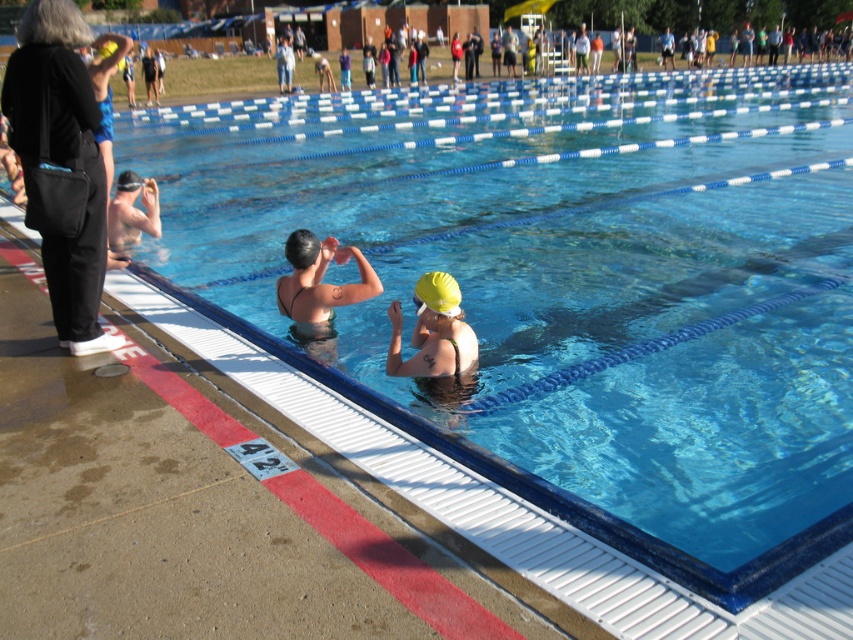
Consider the image. You are a lifeguard standing at the edge of the pool. You need to retrieve the black fabric bag at left and the yellow matte swim cap at center. Which object is closer to the water surface?

The black fabric bag at left is above the yellow matte swim cap at center, so the yellow matte swim cap at center is closer to the water surface.

You are a swimmer standing at the edge of the pool near the starting block. You need to grab your black fabric bag at left before the next race. Can you reach it without leaving the pool area?

The black fabric bag at left is 3.99 meters away from the camera, so you can reach it without leaving the pool area since it is within the poolside area.